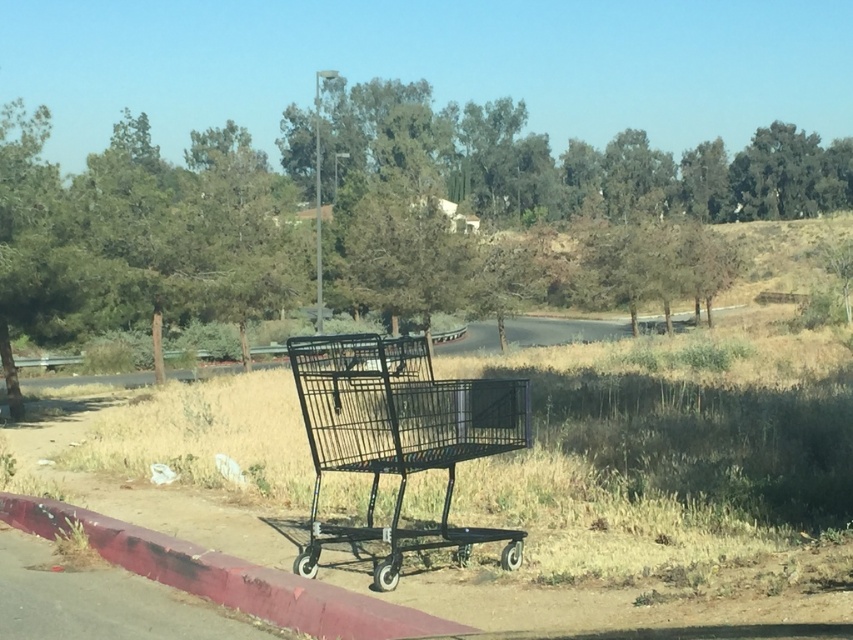
Question: Is black wire shopping cart at center below smooth concrete curb at lower left?

Choices:
 (A) yes
 (B) no

Answer: (B)

Question: Does black wire shopping cart at center appear on the left side of smooth concrete curb at lower left?

Choices:
 (A) no
 (B) yes

Answer: (A)

Question: Among these points, which one is nearest to the camera?

Choices:
 (A) (244, 573)
 (B) (422, 426)

Answer: (B)

Question: Which point is closer to the camera?

Choices:
 (A) smooth concrete curb at lower left
 (B) black wire shopping cart at center

Answer: (A)

Question: Is black wire shopping cart at center thinner than smooth concrete curb at lower left?

Choices:
 (A) yes
 (B) no

Answer: (A)